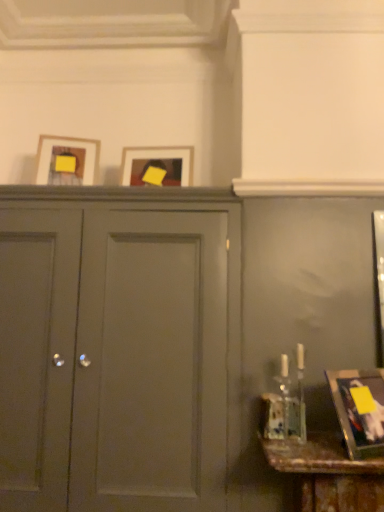
The height and width of the screenshot is (512, 384). I want to click on metallic gold picture frame at lower right, arranged as the 1th picture frame when viewed from the front, so click(358, 410).

You are a GUI agent. You are given a task and a screenshot of the screen. Output one action in this format:
    pyautogui.click(x=<x>, y=<y>)
    Task: Click on the matte wooden picture frame at center, which is counted as the second picture frame, starting from the left
    The height and width of the screenshot is (512, 384).
    Given the screenshot: What is the action you would take?
    158,166

Which object is more forward, matte gray cabinet at center or matte wooden picture frame at upper left, the first picture frame in the left-to-right sequence?

matte gray cabinet at center is more forward.

Can you confirm if matte gray cabinet at center is shorter than matte wooden picture frame at upper left, the second picture frame viewed from the front?

Incorrect, the height of matte gray cabinet at center does not fall short of that of matte wooden picture frame at upper left, the second picture frame viewed from the front.

Between matte gray cabinet at center and matte wooden picture frame at upper left, the third picture frame in the right-to-left sequence, which one has larger width?

With larger width is matte gray cabinet at center.

Considering the relative positions of metallic gold picture frame at lower right, arranged as the 1th picture frame when viewed from the front, and matte gray cabinet at center in the image provided, is metallic gold picture frame at lower right, arranged as the 1th picture frame when viewed from the front, behind matte gray cabinet at center?

No.

Considering the positions of points (376, 455) and (228, 492), is point (376, 455) closer to camera compared to point (228, 492)?

Yes, it is in front of point (228, 492).

Is matte gray cabinet at center at the back of metallic gold picture frame at lower right, the 3th picture frame from the top?

metallic gold picture frame at lower right, the 3th picture frame from the top, does not have its back to matte gray cabinet at center.

Considering the relative positions of metallic gold picture frame at lower right, positioned as the first picture frame in bottom-to-top order, and matte gray cabinet at center in the image provided, is metallic gold picture frame at lower right, positioned as the first picture frame in bottom-to-top order, to the right of matte gray cabinet at center from the viewer's perspective?

Yes, metallic gold picture frame at lower right, positioned as the first picture frame in bottom-to-top order, is to the right of matte gray cabinet at center.

From the image's perspective, relative to metallic gold picture frame at lower right, the 3th picture frame from the top, is matte wooden picture frame at center, the 1th picture frame viewed from the back, above or below?

Based on their image positions, matte wooden picture frame at center, the 1th picture frame viewed from the back, is located above metallic gold picture frame at lower right, the 3th picture frame from the top.

Which is in front, point (124, 177) or point (370, 389)?

The point (370, 389) is in front.

The image size is (384, 512). In order to click on picture frame that is the 1st object above the metallic gold picture frame at lower right, marked as the 3th picture frame in a back-to-front arrangement (from a real-world perspective) in this screenshot , I will do `click(158, 166)`.

From a real-world perspective, is matte wooden picture frame at center, which appears as the 2th picture frame when viewed from the top, located beneath metallic gold picture frame at lower right, placed as the 3th picture frame when sorted from left to right?

→ No.

Does matte gray cabinet at center appear on the right side of metallic gold picture frame at lower right, the 3th picture frame from the top?

In fact, matte gray cabinet at center is to the left of metallic gold picture frame at lower right, the 3th picture frame from the top.

Is metallic gold picture frame at lower right, placed as the 3th picture frame when sorted from left to right, located within matte gray cabinet at center?

No, matte gray cabinet at center does not contain metallic gold picture frame at lower right, placed as the 3th picture frame when sorted from left to right.

Does matte gray cabinet at center touch metallic gold picture frame at lower right, arranged as the 1th picture frame when viewed from the front?

No, matte gray cabinet at center is not next to metallic gold picture frame at lower right, arranged as the 1th picture frame when viewed from the front.

From the matte gray cabinet at center, count 2nd picture frame to the right and point to it. Please provide its 2D coordinates.

[(358, 410)]

Which point is more forward, [44,155] or [365,424]?

Positioned in front is point [365,424].

Is matte wooden picture frame at upper left, the first picture frame in the left-to-right sequence, at the right side of metallic gold picture frame at lower right, placed as the 3th picture frame when sorted from left to right?

No.

Is matte wooden picture frame at upper left, the second picture frame viewed from the front, wider or thinner than metallic gold picture frame at lower right, arranged as the 1th picture frame when viewed from the front?

Clearly, matte wooden picture frame at upper left, the second picture frame viewed from the front, has more width compared to metallic gold picture frame at lower right, arranged as the 1th picture frame when viewed from the front.

How many degrees apart are the facing directions of matte wooden picture frame at center, marked as the third picture frame in a front-to-back arrangement, and matte gray cabinet at center?

There is a 4.31-degree angle between the facing directions of matte wooden picture frame at center, marked as the third picture frame in a front-to-back arrangement, and matte gray cabinet at center.

Does matte wooden picture frame at center, marked as the third picture frame in a front-to-back arrangement, have a greater width compared to matte gray cabinet at center?

No.

Locate an element on the screen. This screenshot has width=384, height=512. door lying below the matte wooden picture frame at center, which ranks as the 2th picture frame in bottom-to-top order (from the image's perspective) is located at coordinates (119, 350).

Considering the sizes of matte wooden picture frame at center, marked as the third picture frame in a front-to-back arrangement, and matte gray cabinet at center in the image, is matte wooden picture frame at center, marked as the third picture frame in a front-to-back arrangement, taller or shorter than matte gray cabinet at center?

In the image, matte wooden picture frame at center, marked as the third picture frame in a front-to-back arrangement, appears to be shorter than matte gray cabinet at center.

Between metallic gold picture frame at lower right, acting as the 1th picture frame starting from the right, and matte wooden picture frame at center, which appears as the 2th picture frame when viewed from the top, which one is positioned behind?

Positioned behind is matte wooden picture frame at center, which appears as the 2th picture frame when viewed from the top.

In the scene shown: Is metallic gold picture frame at lower right, the 3th picture frame from the top, facing towards matte wooden picture frame at center, which ranks as the 2th picture frame in bottom-to-top order?

No, metallic gold picture frame at lower right, the 3th picture frame from the top, is not turned towards matte wooden picture frame at center, which ranks as the 2th picture frame in bottom-to-top order.

Who is bigger, metallic gold picture frame at lower right, acting as the 1th picture frame starting from the right, or matte wooden picture frame at center, the 1th picture frame viewed from the back?

With larger size is metallic gold picture frame at lower right, acting as the 1th picture frame starting from the right.

Between metallic gold picture frame at lower right, arranged as the 1th picture frame when viewed from the front, and matte wooden picture frame at center, which ranks as the 2th picture frame in bottom-to-top order, which one appears on the left side from the viewer's perspective?

Positioned to the left is matte wooden picture frame at center, which ranks as the 2th picture frame in bottom-to-top order.

You are a GUI agent. You are given a task and a screenshot of the screen. Output one action in this format:
    pyautogui.click(x=<x>, y=<y>)
    Task: Click on the 2nd picture frame directly above the matte gray cabinet at center (from a real-world perspective)
    The width and height of the screenshot is (384, 512).
    Given the screenshot: What is the action you would take?
    pyautogui.click(x=68, y=159)

Locate an element on the screen. The width and height of the screenshot is (384, 512). picture frame below the matte gray cabinet at center (from a real-world perspective) is located at coordinates (358, 410).

Considering their positions, is matte wooden picture frame at center, marked as the third picture frame in a front-to-back arrangement, positioned closer to metallic gold picture frame at lower right, placed as the 3th picture frame when sorted from left to right, than matte wooden picture frame at upper left, which is counted as the first picture frame, starting from the top?

Based on the image, matte wooden picture frame at center, marked as the third picture frame in a front-to-back arrangement, appears to be nearer to metallic gold picture frame at lower right, placed as the 3th picture frame when sorted from left to right.

Looking at the image, which one is located closer to matte wooden picture frame at center, the 2th picture frame viewed from the right, matte gray cabinet at center or matte wooden picture frame at upper left, the first picture frame in the left-to-right sequence?

matte wooden picture frame at upper left, the first picture frame in the left-to-right sequence, is positioned closer to the anchor matte wooden picture frame at center, the 2th picture frame viewed from the right.

Based on their spatial positions, is matte wooden picture frame at center, the 2th picture frame viewed from the right, or matte gray cabinet at center closer to matte wooden picture frame at upper left, which is counted as the first picture frame, starting from the top?

Among the two, matte wooden picture frame at center, the 2th picture frame viewed from the right, is located nearer to matte wooden picture frame at upper left, which is counted as the first picture frame, starting from the top.

From the image, which object appears to be nearer to matte gray cabinet at center, matte wooden picture frame at center, the 2th picture frame viewed from the right, or matte wooden picture frame at upper left, the third picture frame in the right-to-left sequence?

matte wooden picture frame at center, the 2th picture frame viewed from the right, lies closer to matte gray cabinet at center than the other object.

From the image, which object appears to be farther from matte wooden picture frame at center, which appears as the 2th picture frame when viewed from the top, matte wooden picture frame at upper left, the 2th picture frame when ordered from back to front, or metallic gold picture frame at lower right, the 3th picture frame from the top?

metallic gold picture frame at lower right, the 3th picture frame from the top, lies further to matte wooden picture frame at center, which appears as the 2th picture frame when viewed from the top, than the other object.

From the image, which object appears to be nearer to matte gray cabinet at center, metallic gold picture frame at lower right, positioned as the first picture frame in bottom-to-top order, or matte wooden picture frame at center, which ranks as the 2th picture frame in bottom-to-top order?

The object closer to matte gray cabinet at center is matte wooden picture frame at center, which ranks as the 2th picture frame in bottom-to-top order.

Considering their positions, is metallic gold picture frame at lower right, marked as the 3th picture frame in a back-to-front arrangement, positioned closer to matte wooden picture frame at upper left, the third picture frame in the right-to-left sequence, than matte wooden picture frame at center, which is counted as the second picture frame, starting from the left?

matte wooden picture frame at center, which is counted as the second picture frame, starting from the left, lies closer to matte wooden picture frame at upper left, the third picture frame in the right-to-left sequence, than the other object.

From the image, which object appears to be nearer to metallic gold picture frame at lower right, the 3th picture frame from the top, matte gray cabinet at center or matte wooden picture frame at upper left, the 2th picture frame when ordered from back to front?

matte gray cabinet at center is positioned closer to the anchor metallic gold picture frame at lower right, the 3th picture frame from the top.

The image size is (384, 512). I want to click on picture frame between matte wooden picture frame at upper left, the third picture frame in the right-to-left sequence, and matte gray cabinet at center, in the vertical direction, so click(158, 166).

Identify the location of picture frame between matte wooden picture frame at upper left, the first picture frame in the left-to-right sequence, and metallic gold picture frame at lower right, the 3th picture frame from the top, from left to right. click(158, 166).

Locate an element on the screen. This screenshot has height=512, width=384. door between matte wooden picture frame at upper left, the third picture frame in the right-to-left sequence, and metallic gold picture frame at lower right, the 3th picture frame from the top, in the horizontal direction is located at coordinates (119, 350).

You are a GUI agent. You are given a task and a screenshot of the screen. Output one action in this format:
    pyautogui.click(x=<x>, y=<y>)
    Task: Click on the picture frame between matte gray cabinet at center and metallic gold picture frame at lower right, positioned as the first picture frame in bottom-to-top order
    This screenshot has width=384, height=512.
    Given the screenshot: What is the action you would take?
    pyautogui.click(x=158, y=166)